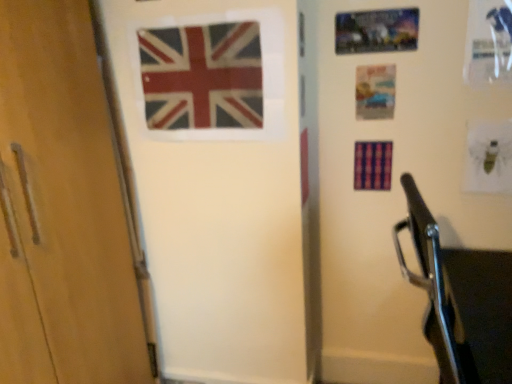
I want to click on matte plastic flag at center, the second flag in the left-to-right sequence, so click(x=304, y=165).

In order to face matte plastic flag at center, the second flag in the left-to-right sequence, should I rotate leftwards or rightwards?

Turn right approximately 6.449 degrees to face it.

What do you see at coordinates (375, 91) in the screenshot? The width and height of the screenshot is (512, 384). I see `matte paper postcard at upper right, acting as the 2th postcard starting from the top` at bounding box center [375, 91].

Where is `matte paper postcard at upper right, which is the 1th postcard from bottom to top`? This screenshot has width=512, height=384. matte paper postcard at upper right, which is the 1th postcard from bottom to top is located at coordinates (375, 91).

Where is `plaid fabric flag at center, the third flag viewed from the left`? plaid fabric flag at center, the third flag viewed from the left is located at coordinates (373, 165).

At what (x,y) coordinates should I click in order to perform the action: click on matte fabric flag at upper center, the third flag viewed from the right. Please return your answer as a coordinate pair (x, y). This screenshot has width=512, height=384. Looking at the image, I should click on (202, 76).

Does matte plastic flag at center, the 2th flag in the right-to-left sequence, lie in front of plaid fabric flag at center, which is the first flag in right-to-left order?

Yes, it is.

Would you say matte plastic flag at center, the 2th flag in the right-to-left sequence, contains plaid fabric flag at center, which is the first flag in right-to-left order?

No, matte plastic flag at center, the 2th flag in the right-to-left sequence, does not contain plaid fabric flag at center, which is the first flag in right-to-left order.

Which of these two, matte plastic flag at center, the 2th flag in the right-to-left sequence, or plaid fabric flag at center, which is the first flag in right-to-left order, is bigger?

Bigger between the two is matte plastic flag at center, the 2th flag in the right-to-left sequence.

Is matte plastic flag at center, the second flag in the left-to-right sequence, not near plaid fabric flag at center, the third flag viewed from the left?

No, matte plastic flag at center, the second flag in the left-to-right sequence, is in close proximity to plaid fabric flag at center, the third flag viewed from the left.

Can you tell me how much plaid fabric flag at center, which is the first flag in right-to-left order, and matte fabric flag at upper center, the first flag from the left, differ in facing direction?

The angular difference between plaid fabric flag at center, which is the first flag in right-to-left order, and matte fabric flag at upper center, the first flag from the left, is 0.675 degrees.

Which of these two, plaid fabric flag at center, which is the first flag in right-to-left order, or matte fabric flag at upper center, the first flag from the left, is thinner?

matte fabric flag at upper center, the first flag from the left, is thinner.

Does plaid fabric flag at center, which is the first flag in right-to-left order, touch matte fabric flag at upper center, the third flag viewed from the right?

There is a gap between plaid fabric flag at center, which is the first flag in right-to-left order, and matte fabric flag at upper center, the third flag viewed from the right.

From the image's perspective, would you say plaid fabric flag at center, which is the first flag in right-to-left order, is shown under matte fabric flag at upper center, the first flag from the left?

Yes, from the image's perspective, plaid fabric flag at center, which is the first flag in right-to-left order, is beneath matte fabric flag at upper center, the first flag from the left.

Based on the photo, from a real-world perspective, is metallic silver postcard at upper right, the second postcard from the bottom, positioned under matte plastic flag at center, the 2th flag in the right-to-left sequence, based on gravity?

No, from a real-world perspective, metallic silver postcard at upper right, the second postcard from the bottom, is not below matte plastic flag at center, the 2th flag in the right-to-left sequence.

Is metallic silver postcard at upper right, the second postcard from the bottom, wider than matte plastic flag at center, the 2th flag in the right-to-left sequence?

Indeed, metallic silver postcard at upper right, the second postcard from the bottom, has a greater width compared to matte plastic flag at center, the 2th flag in the right-to-left sequence.

Considering the positions of objects metallic silver postcard at upper right, the second postcard from the bottom, and matte plastic flag at center, the 2th flag in the right-to-left sequence, in the image provided, who is more to the right, metallic silver postcard at upper right, the second postcard from the bottom, or matte plastic flag at center, the 2th flag in the right-to-left sequence,?

From the viewer's perspective, metallic silver postcard at upper right, the second postcard from the bottom, appears more on the right side.

Does matte fabric flag at upper center, the third flag viewed from the right, have a greater width compared to metallic silver postcard at upper right, the second postcard from the bottom?

Indeed, matte fabric flag at upper center, the third flag viewed from the right, has a greater width compared to metallic silver postcard at upper right, the second postcard from the bottom.

Looking at this image, visually, is matte fabric flag at upper center, the third flag viewed from the right, positioned to the left or to the right of metallic silver postcard at upper right, the second postcard from the bottom?

Based on their positions, matte fabric flag at upper center, the third flag viewed from the right, is located to the left of metallic silver postcard at upper right, the second postcard from the bottom.

Which is correct: matte fabric flag at upper center, the third flag viewed from the right, is inside metallic silver postcard at upper right, arranged as the 1th postcard when viewed from the top, or outside of it?

matte fabric flag at upper center, the third flag viewed from the right, cannot be found inside metallic silver postcard at upper right, arranged as the 1th postcard when viewed from the top.

Based on the photo, is metallic silver postcard at upper right, the second postcard from the bottom, located outside plaid fabric flag at center, the third flag viewed from the left?

Yes, metallic silver postcard at upper right, the second postcard from the bottom, is located beyond the bounds of plaid fabric flag at center, the third flag viewed from the left.

Is metallic silver postcard at upper right, the second postcard from the bottom, looking in the opposite direction of plaid fabric flag at center, which is the first flag in right-to-left order?

metallic silver postcard at upper right, the second postcard from the bottom, does not have its back to plaid fabric flag at center, which is the first flag in right-to-left order.

Which of these two, metallic silver postcard at upper right, arranged as the 1th postcard when viewed from the top, or plaid fabric flag at center, which is the first flag in right-to-left order, stands shorter?

metallic silver postcard at upper right, arranged as the 1th postcard when viewed from the top.

Considering the positions of point (410, 32) and point (362, 177), is point (410, 32) closer or farther from the camera than point (362, 177)?

Clearly, point (410, 32) is closer to the camera than point (362, 177).

Visually, is plaid fabric flag at center, which is the first flag in right-to-left order, positioned to the left or to the right of matte plastic flag at center, the 2th flag in the right-to-left sequence?

In the image, plaid fabric flag at center, which is the first flag in right-to-left order, appears on the right side of matte plastic flag at center, the 2th flag in the right-to-left sequence.

How much distance is there between plaid fabric flag at center, the third flag viewed from the left, and matte plastic flag at center, the second flag in the left-to-right sequence?

plaid fabric flag at center, the third flag viewed from the left, and matte plastic flag at center, the second flag in the left-to-right sequence, are 9.89 inches apart from each other.

Considering the relative sizes of plaid fabric flag at center, which is the first flag in right-to-left order, and matte plastic flag at center, the 2th flag in the right-to-left sequence, in the image provided, is plaid fabric flag at center, which is the first flag in right-to-left order, taller than matte plastic flag at center, the 2th flag in the right-to-left sequence,?

In fact, plaid fabric flag at center, which is the first flag in right-to-left order, may be shorter than matte plastic flag at center, the 2th flag in the right-to-left sequence.

Which is behind, plaid fabric flag at center, which is the first flag in right-to-left order, or matte plastic flag at center, the second flag in the left-to-right sequence?

plaid fabric flag at center, which is the first flag in right-to-left order, is more distant.

Does metallic silver postcard at upper right, arranged as the 1th postcard when viewed from the top, appear on the right side of matte paper postcard at upper right, which is the 1th postcard from bottom to top?

In fact, metallic silver postcard at upper right, arranged as the 1th postcard when viewed from the top, is to the left of matte paper postcard at upper right, which is the 1th postcard from bottom to top.

Consider the image. Can we say metallic silver postcard at upper right, the second postcard from the bottom, lies outside matte paper postcard at upper right, which is the 1th postcard from bottom to top?

Yes, metallic silver postcard at upper right, the second postcard from the bottom, is not within matte paper postcard at upper right, which is the 1th postcard from bottom to top.

Is metallic silver postcard at upper right, the second postcard from the bottom, bigger than matte paper postcard at upper right, acting as the 2th postcard starting from the top?

Yes, metallic silver postcard at upper right, the second postcard from the bottom, is bigger than matte paper postcard at upper right, acting as the 2th postcard starting from the top.

Are metallic silver postcard at upper right, arranged as the 1th postcard when viewed from the top, and matte paper postcard at upper right, which is the 1th postcard from bottom to top, making contact?

metallic silver postcard at upper right, arranged as the 1th postcard when viewed from the top, and matte paper postcard at upper right, which is the 1th postcard from bottom to top, are clearly separated.

Locate an element on the screen. flag behind the matte plastic flag at center, the 2th flag in the right-to-left sequence is located at coordinates (373, 165).

At what (x,y) coordinates should I click in order to perform the action: click on the 2nd flag in front of the plaid fabric flag at center, the third flag viewed from the left. Please return your answer as a coordinate pair (x, y). This screenshot has width=512, height=384. Looking at the image, I should click on (202, 76).

From the image, which object appears to be nearer to matte paper postcard at upper right, which is the 1th postcard from bottom to top, matte plastic flag at center, the second flag in the left-to-right sequence, or metallic silver postcard at upper right, the second postcard from the bottom?

Among the two, metallic silver postcard at upper right, the second postcard from the bottom, is located nearer to matte paper postcard at upper right, which is the 1th postcard from bottom to top.

Which object lies further to the anchor point matte paper postcard at upper right, which is the 1th postcard from bottom to top, metallic silver postcard at upper right, the second postcard from the bottom, or plaid fabric flag at center, the third flag viewed from the left?

Among the two, plaid fabric flag at center, the third flag viewed from the left, is located further to matte paper postcard at upper right, which is the 1th postcard from bottom to top.

Considering their positions, is metallic silver postcard at upper right, the second postcard from the bottom, positioned further to plaid fabric flag at center, the third flag viewed from the left, than matte paper postcard at upper right, acting as the 2th postcard starting from the top?

metallic silver postcard at upper right, the second postcard from the bottom.

Estimate the real-world distances between objects in this image. Which object is further from metallic silver postcard at upper right, arranged as the 1th postcard when viewed from the top, plaid fabric flag at center, which is the first flag in right-to-left order, or matte plastic flag at center, the 2th flag in the right-to-left sequence?

matte plastic flag at center, the 2th flag in the right-to-left sequence.

When comparing their distances from matte plastic flag at center, the 2th flag in the right-to-left sequence, does matte fabric flag at upper center, the third flag viewed from the right, or matte paper postcard at upper right, which is the 1th postcard from bottom to top, seem closer?

Among the two, matte paper postcard at upper right, which is the 1th postcard from bottom to top, is located nearer to matte plastic flag at center, the 2th flag in the right-to-left sequence.

Estimate the real-world distances between objects in this image. Which object is further from matte paper postcard at upper right, which is the 1th postcard from bottom to top, matte plastic flag at center, the second flag in the left-to-right sequence, or plaid fabric flag at center, the third flag viewed from the left?

matte plastic flag at center, the second flag in the left-to-right sequence.

Based on their spatial positions, is plaid fabric flag at center, which is the first flag in right-to-left order, or matte fabric flag at upper center, the first flag from the left, closer to matte paper postcard at upper right, which is the 1th postcard from bottom to top?

plaid fabric flag at center, which is the first flag in right-to-left order.

Considering their positions, is matte paper postcard at upper right, which is the 1th postcard from bottom to top, positioned closer to metallic silver postcard at upper right, arranged as the 1th postcard when viewed from the top, than matte plastic flag at center, the 2th flag in the right-to-left sequence?

matte paper postcard at upper right, which is the 1th postcard from bottom to top, lies closer to metallic silver postcard at upper right, arranged as the 1th postcard when viewed from the top, than the other object.

This screenshot has height=384, width=512. I want to click on flag between matte fabric flag at upper center, the first flag from the left, and matte paper postcard at upper right, acting as the 2th postcard starting from the top, from left to right, so click(304, 165).

Locate an element on the screen. The width and height of the screenshot is (512, 384). postcard that lies between metallic silver postcard at upper right, arranged as the 1th postcard when viewed from the top, and matte plastic flag at center, the second flag in the left-to-right sequence, from top to bottom is located at coordinates (375, 91).

Identify the location of postcard between metallic silver postcard at upper right, arranged as the 1th postcard when viewed from the top, and plaid fabric flag at center, which is the first flag in right-to-left order, in the vertical direction. The width and height of the screenshot is (512, 384). coord(375,91).

This screenshot has height=384, width=512. Identify the location of flag located between matte fabric flag at upper center, the first flag from the left, and plaid fabric flag at center, the third flag viewed from the left, in the left-right direction. (304, 165).